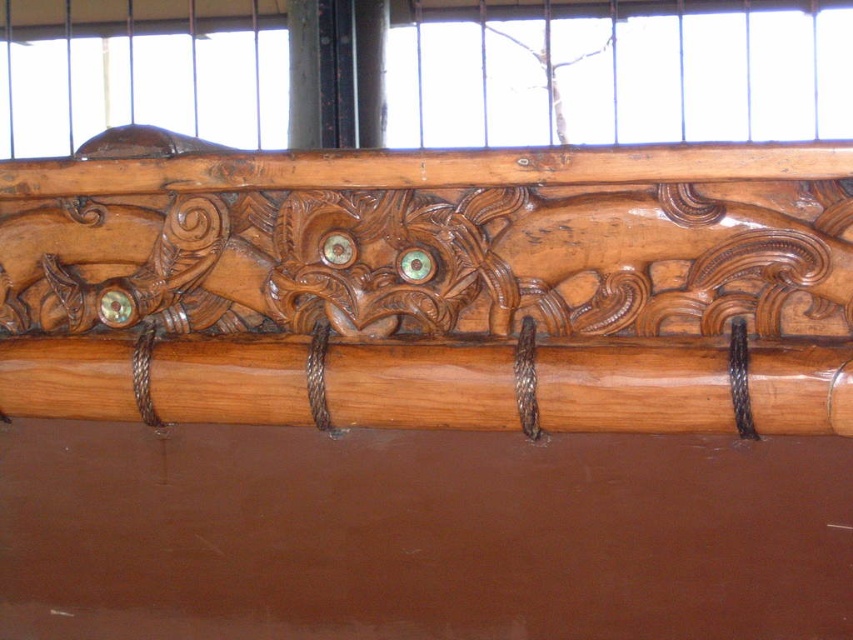
Looking at this image, you are an interior designer assessing the wooden paneling. You notice two elements at the center of the carving. One is labeled as the shiny brown wood carving at center and the other as the shiny brown wood at center. Which of these two elements is taller?

The shiny brown wood carving at center is taller than the shiny brown wood at center.

You are an artisan working on a wooden panel. You have two objects in front of you, the shiny brown wood carving at center and the shiny brown wood at center. Your task is to place a decorative inlay between them. How far apart should you position the inlay from each object to maintain equal distance?

The distance between the shiny brown wood carving at center and the shiny brown wood at center is 7.45 centimeters. To place the inlay equidistant from both, position it 3.725 centimeters away from each object.